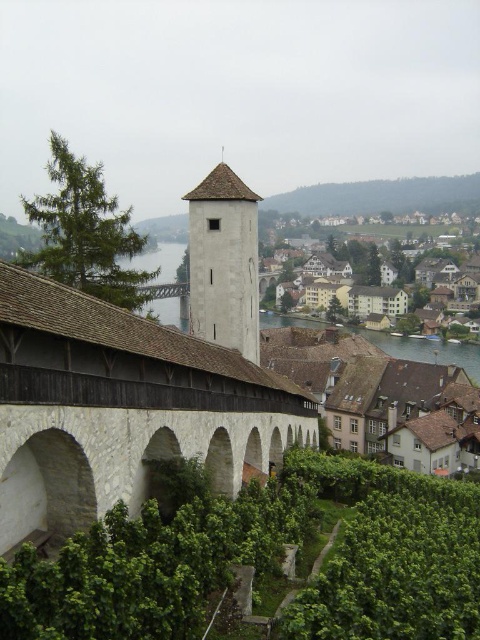
You are a tourist standing on the riverbank and want to take a photo of both the white stone bridge at center and the white stone tower at center. Since you have a camera with a fixed focal length, you need to know which object is bigger in the image to frame your shot properly. Which one should you focus on first to ensure both are in frame?

The white stone bridge at center is larger in size than the white stone tower at center, so you should focus on the white stone bridge at center first to ensure both are in frame.

You are a tourist standing on the left side of the white stone bridge at center, planning to walk to the white stone tower at center. The bridge has a wooden roof that limits your path. Given that your backpack is 1.2 meters wide, can you safely pass through the bridge to reach the tower?

The white stone bridge at center has a width larger than the white stone tower at center. However, the question is about the bridge itself. Since the bridge is wider than the tower, but the backpack width is 1.2 meters, we need to know the bridge width. Wait, the description says the bridge is wider than the tower, but without specific measurements, we can infer the bridge is wide enough. But the answer must use the objects description. The objects description says the bridge is wider than the tower, but we